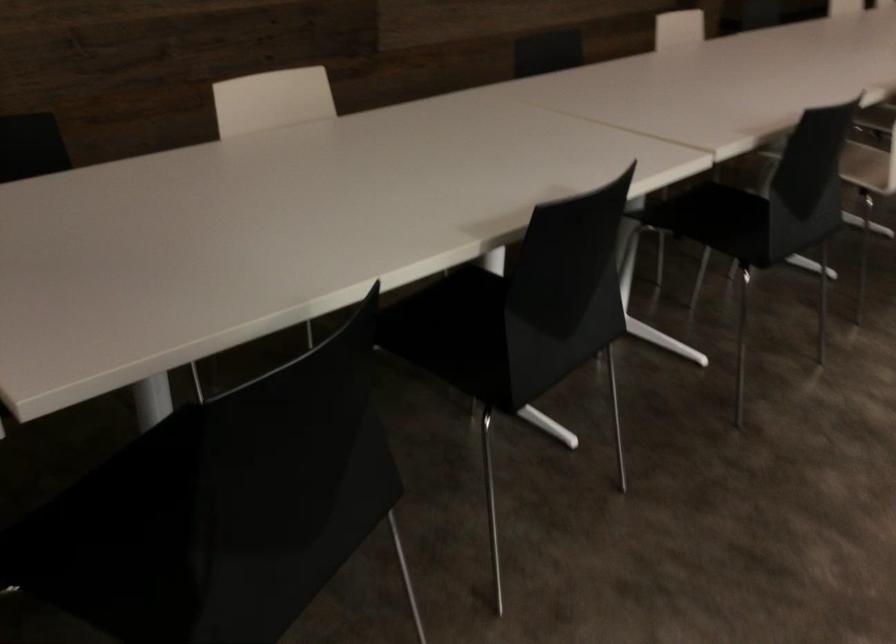
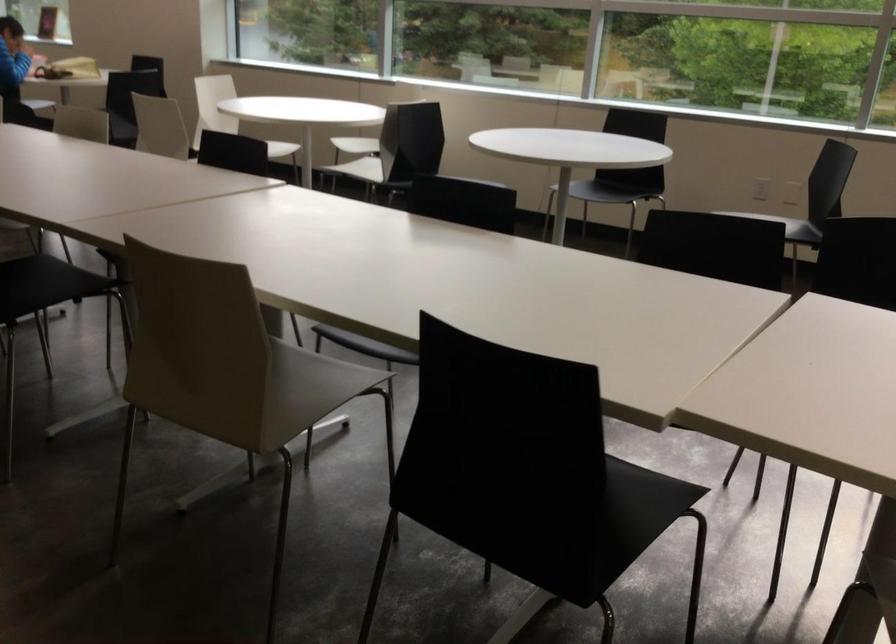
Question: I am providing you with two images of the same scene from different viewpoints. Which of the following objects are not visible in image2?

Choices:
 (A) white chair sitting surface
 (B) black chair sitting surface
 (C) silver latch handle
 (D) light switch

Answer: (A)